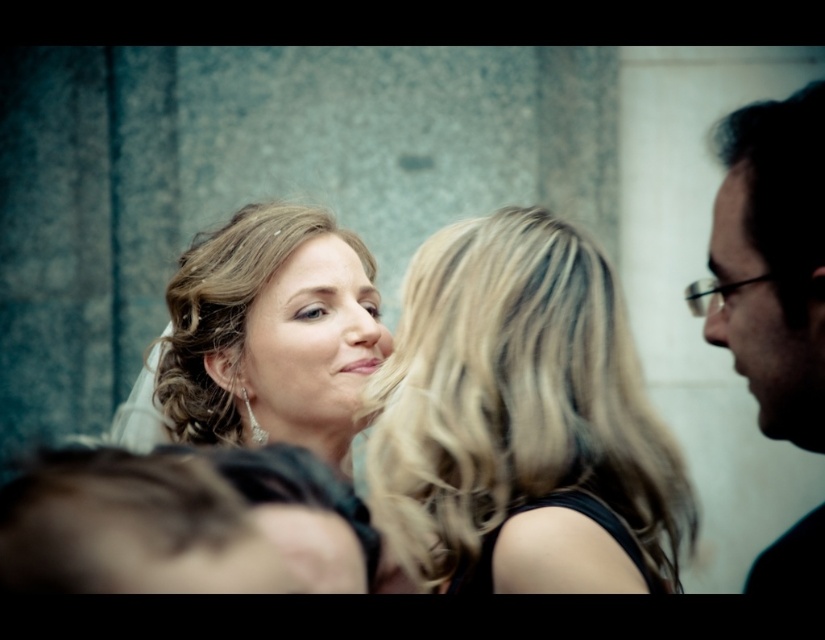
Question: Which of the following is the farthest from the observer?

Choices:
 (A) dark brown hair at right
 (B) matte gold hair at center

Answer: (B)

Question: Considering the real-world distances, which object is farthest from the blonde shiny hair at center?

Choices:
 (A) blonde hair at center
 (B) black matte glasses at right
 (C) dark brown hair at right

Answer: (C)

Question: Is matte gold hair at center smaller than black glossy glasses at right?

Choices:
 (A) yes
 (B) no

Answer: (B)

Question: Is blonde hair at center to the left of blonde shiny hair at center from the viewer's perspective?

Choices:
 (A) no
 (B) yes

Answer: (A)

Question: Which object is the farthest from the dark brown hair at right?

Choices:
 (A) black matte glasses at right
 (B) black glossy glasses at right
 (C) blonde shiny hair at center

Answer: (C)

Question: Does blonde hair at center have a larger size compared to black matte glasses at right?

Choices:
 (A) yes
 (B) no

Answer: (A)